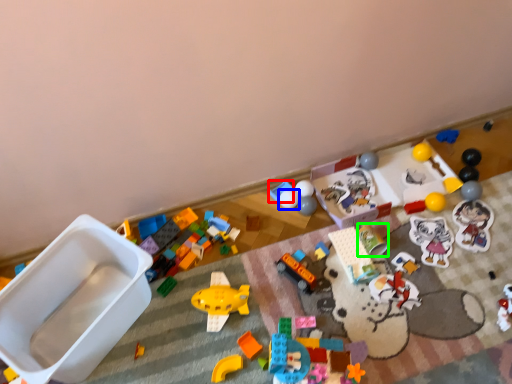
Question: Estimate the real-world distances between objects in this image. Which object is closer to toy (highlighted by a red box), toy (highlighted by a blue box) or toy (highlighted by a green box)?

Choices:
 (A) toy
 (B) toy

Answer: (A)